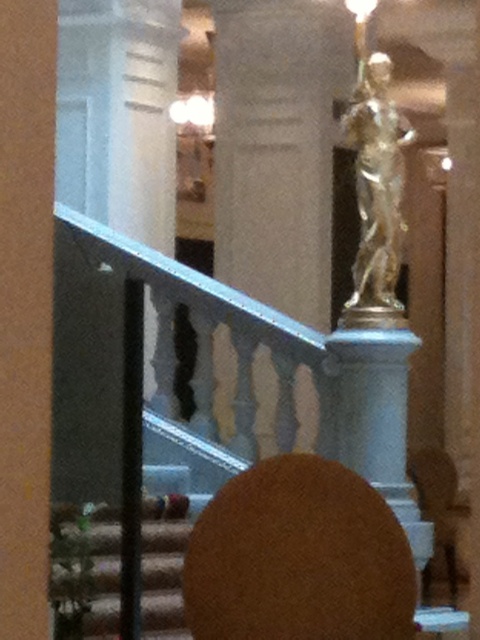
Question: Can you confirm if white marble pillar at center is positioned below gold metallic statue at upper center?

Choices:
 (A) yes
 (B) no

Answer: (B)

Question: Considering the real-world distances, which object is closest to the gold metallic statue at upper center?

Choices:
 (A) white marble pillar at center
 (B) brown leather chair at lower right

Answer: (A)

Question: Based on their relative distances, which object is nearer to the white marble pillar at center?

Choices:
 (A) brown leather chair at lower right
 (B) gold metallic statue at upper center

Answer: (B)

Question: Which point is farther to the camera?

Choices:
 (A) (435, 570)
 (B) (288, 67)

Answer: (B)

Question: Considering the relative positions of white marble pillar at center and gold metallic statue at upper center in the image provided, where is white marble pillar at center located with respect to gold metallic statue at upper center?

Choices:
 (A) right
 (B) left

Answer: (B)

Question: Does gold metallic statue at upper center appear under brown leather chair at lower right?

Choices:
 (A) yes
 (B) no

Answer: (B)